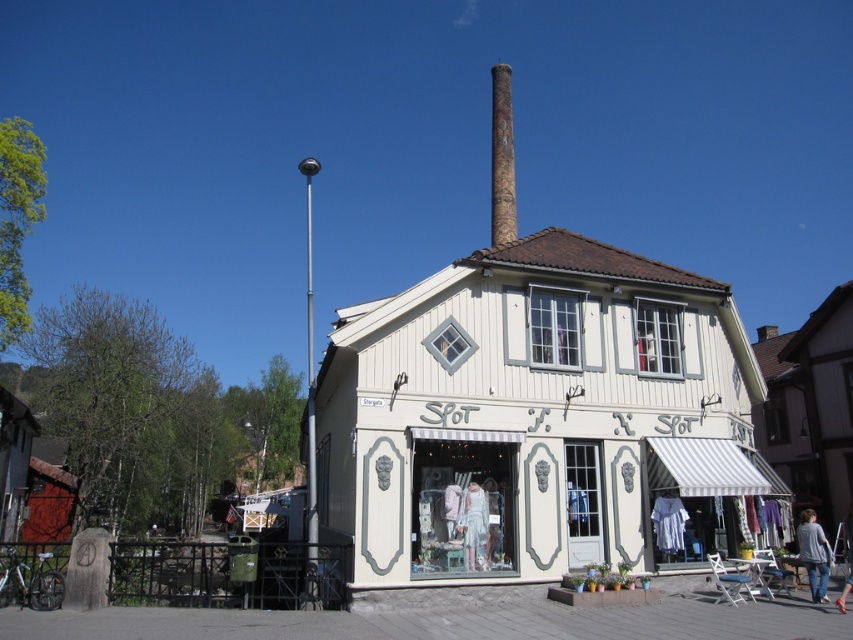
Question: Is white wood storefront at center closer to the viewer compared to white fabric dress at center?

Choices:
 (A) no
 (B) yes

Answer: (B)

Question: Which point is farther to the camera?

Choices:
 (A) rusty metal chimney at center
 (B) white wood storefront at center
 (C) white fabric dress at center

Answer: (A)

Question: Is rusty metal chimney at center to the left of white fabric dress at center from the viewer's perspective?

Choices:
 (A) yes
 (B) no

Answer: (B)

Question: In this image, where is white fabric dress at center located relative to gray sweater at lower right?

Choices:
 (A) right
 (B) left

Answer: (B)

Question: Which point is farther to the camera?

Choices:
 (A) white wood storefront at center
 (B) white fabric dress at center
 (C) rusty metal chimney at center
 (D) gray sweater at lower right

Answer: (C)

Question: Considering the real-world distances, which object is closest to the white fabric dress at center?

Choices:
 (A) rusty metal chimney at center
 (B) white wood storefront at center

Answer: (B)